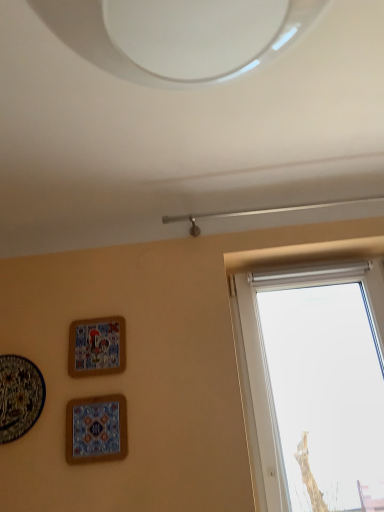
Question: Considering their positions, is matte ceramic plate at lower left, acting as the 3th picture frame starting from the right, located in front of or behind matte ceramic tile at lower left, marked as the first picture frame in a right-to-left arrangement?

Choices:
 (A) front
 (B) behind

Answer: (B)

Question: In terms of size, does matte ceramic plate at lower left, the 1th picture frame from the left, appear bigger or smaller than matte ceramic tile at lower left, the 3th picture frame positioned from the left?

Choices:
 (A) small
 (B) big

Answer: (B)

Question: Estimate the real-world distances between objects in this image. Which object is closer to the matte ceramic plate at lower left, the 1th picture frame from the left?

Choices:
 (A) matte ceramic tile at lower left, marked as the first picture frame in a right-to-left arrangement
 (B) matte ceramic picture frame at upper left, placed as the 2th picture frame when sorted from right to left

Answer: (A)

Question: Estimate the real-world distances between objects in this image. Which object is closer to the matte ceramic picture frame at upper left, positioned as the second picture frame in left-to-right order?

Choices:
 (A) matte ceramic plate at lower left, the 1th picture frame from the left
 (B) matte ceramic tile at lower left, marked as the first picture frame in a right-to-left arrangement

Answer: (B)